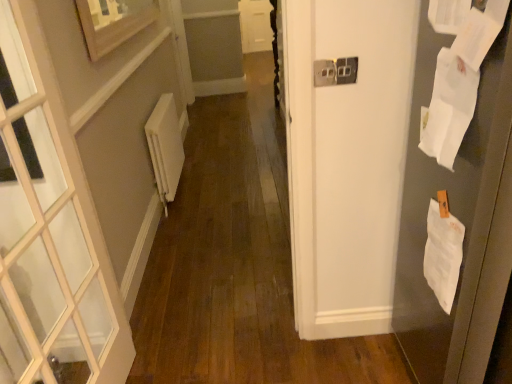
The width and height of the screenshot is (512, 384). I want to click on free area behind white matte radiator at left, so click(201, 168).